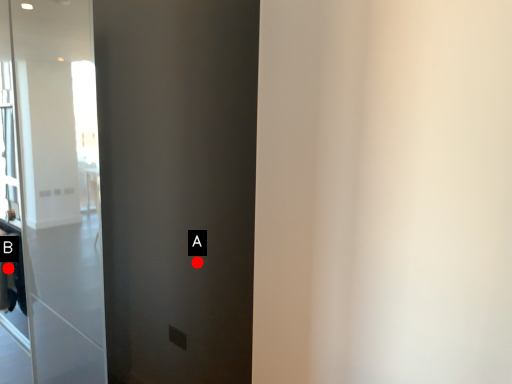
Question: Two points are circled on the image, labeled by A and B beside each circle. Which point is further to the camera?

Choices:
 (A) A is further
 (B) B is further

Answer: (B)